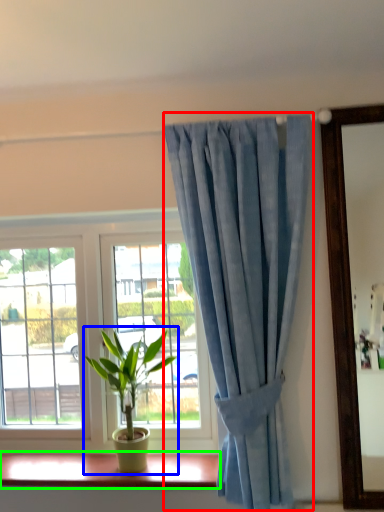
Question: Based on their relative distances, which object is farther from curtain (highlighted by a red box)? Choose from houseplant (highlighted by a blue box) and window sill (highlighted by a green box).

Choices:
 (A) houseplant
 (B) window sill

Answer: (B)